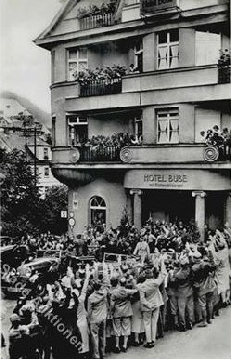
You are a GUI agent. You are given a task and a screenshot of the screen. Output one action in this format:
    pyautogui.click(x=<x>, y=<y>)
    Task: Click on the window
    The width and height of the screenshot is (231, 359).
    Given the screenshot: What is the action you would take?
    pyautogui.click(x=99, y=217), pyautogui.click(x=169, y=127), pyautogui.click(x=169, y=54), pyautogui.click(x=81, y=126), pyautogui.click(x=76, y=64), pyautogui.click(x=139, y=53), pyautogui.click(x=48, y=175), pyautogui.click(x=46, y=152)